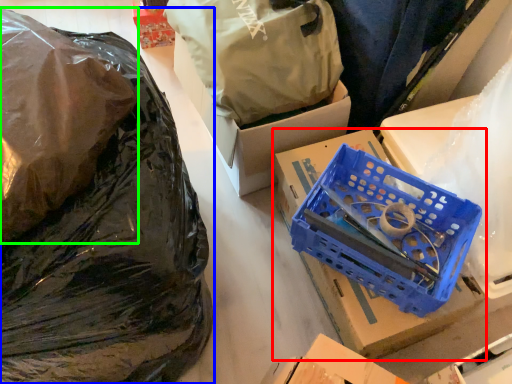
Question: Estimate the real-world distances between objects in this image. Which object is farther from box (highlighted by a red box), plastic bag (highlighted by a blue box) or plastic bag (highlighted by a green box)?

Choices:
 (A) plastic bag
 (B) plastic bag

Answer: (B)